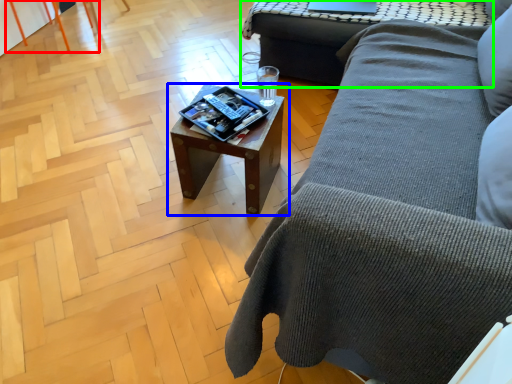
Question: Which object is positioned closest to chair (highlighted by a red box)? Select from table (highlighted by a blue box) and table (highlighted by a green box).

Choices:
 (A) table
 (B) table

Answer: (B)